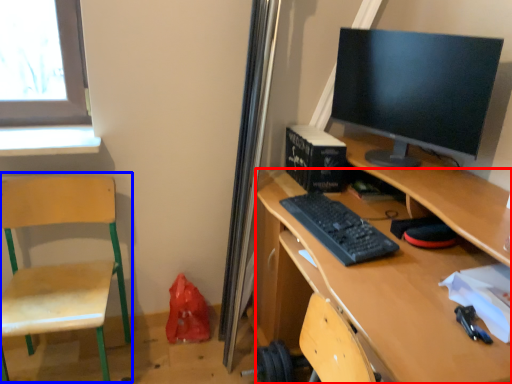
Question: Which point is further to the camera, desk (highlighted by a red box) or swivel chair (highlighted by a blue box)?

Choices:
 (A) desk
 (B) swivel chair

Answer: (B)